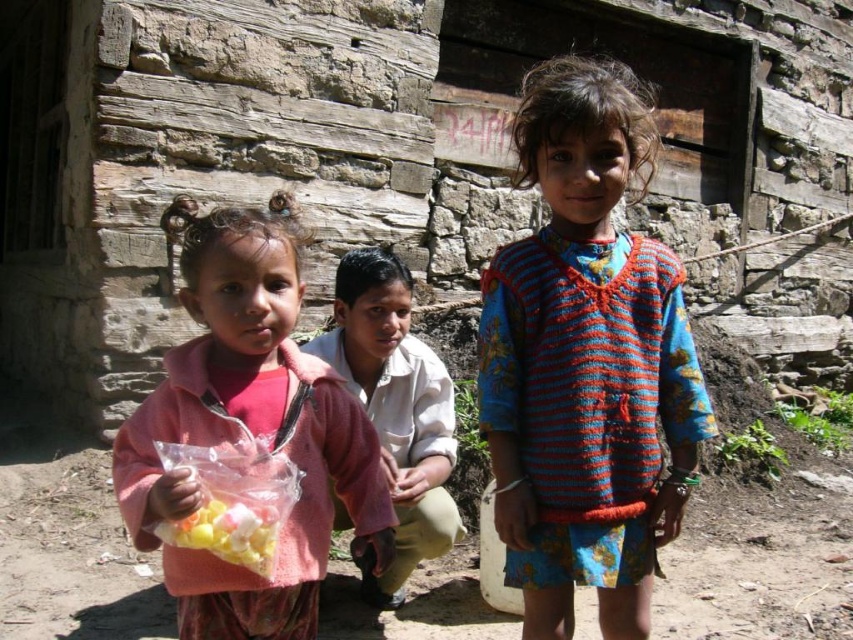
Based on the photo, you are a photographer trying to capture a photo of the knitted wool sweater at center and the translucent plastic bag of colorful candies at lower left. Since you want both items to be clearly visible in the frame, which object should you focus on first to ensure proper focus?

The knitted wool sweater at center is taller than the translucent plastic bag of colorful candies at lower left, so focusing on the knitted wool sweater at center first will ensure it is in focus, and the bag will also be in focus due to its smaller size.

In the scene shown: You are a photographer trying to capture the children in the scene. You need to focus on the knitted wool sweater at center and the pink fabric at center. Which one is positioned higher in the image?

The knitted wool sweater at center is above the pink fabric at center, so it is positioned higher in the image.